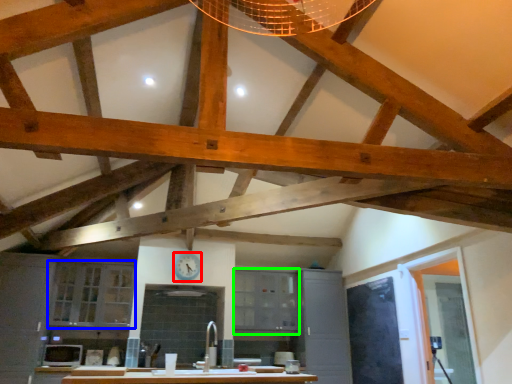
Question: Which object is the closest to the clock (highlighted by a red box)? Choose among these: cabinetry (highlighted by a blue box) or cabinetry (highlighted by a green box).

Choices:
 (A) cabinetry
 (B) cabinetry

Answer: (B)